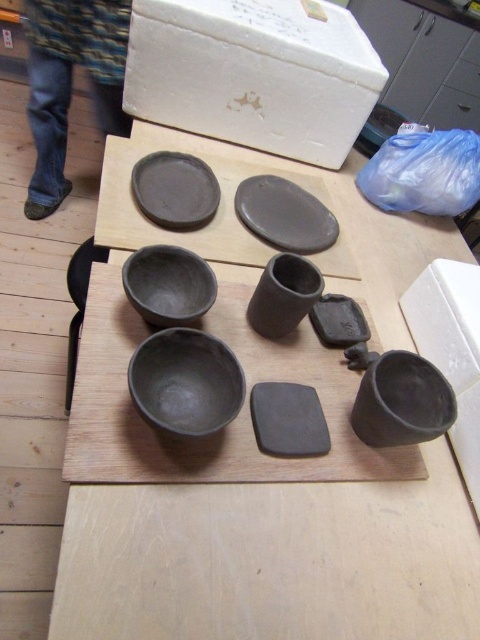
Is matte black plate at upper center smaller than matte black cup at center?

No, matte black plate at upper center is not smaller than matte black cup at center.

In the scene shown: Which is above, matte black plate at upper center or matte black cup at center?

matte black plate at upper center is higher up.

Is point (277, 193) farther from camera compared to point (284, 264)?

Yes, point (277, 193) is farther from viewer.

I want to click on matte black plate at upper center, so click(285, 214).

Can you confirm if matte black cup at lower right is taller than matte black bowl at center-left?

Indeed, matte black cup at lower right has a greater height compared to matte black bowl at center-left.

Is matte black cup at lower right smaller than matte black bowl at center-left?

No.

Identify the location of matte black cup at lower right. This screenshot has height=640, width=480. (402, 401).

Does point (143, 348) come in front of point (241, 212)?

Yes, it is in front of point (241, 212).

Between point (147, 404) and point (288, 228), which one is positioned behind?

Point (288, 228)

Who is more forward, (157, 397) or (267, 220)?

Point (157, 397)

This screenshot has width=480, height=640. I want to click on matte black bowl at center, so click(186, 381).